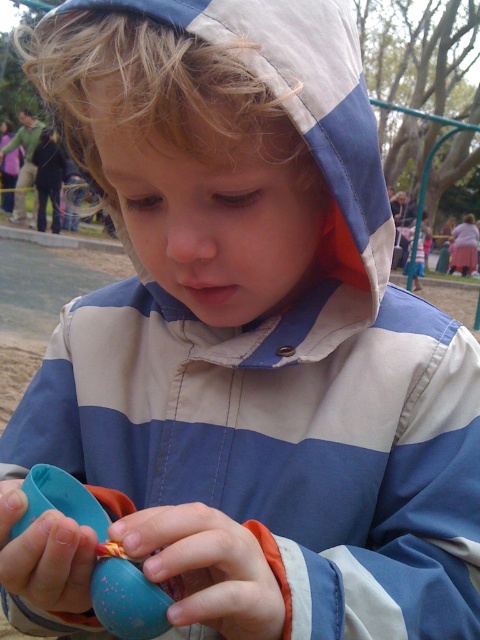
You are a photographer trying to capture a closeup of the child holding the blue rubber toy at center and the matte plastic egg at center. Which object should you focus on if you want to highlight the one that is positioned more to the right?

The blue rubber toy at center is to the right of the matte plastic egg at center, so you should focus on the blue rubber toy at center to highlight the one more to the right.

You are a photographer trying to capture a closeup of the blue rubber toy at center. The camera you are using has a focal length of 50mm. Given that the toy is at coordinates point 0.889, 0.431, can you determine if the toy will be in the frame?

The blue rubber toy at center is positioned at point [206,568], which falls within the standard frame boundaries of a 50mm lens. Therefore, the toy will be in the frame.